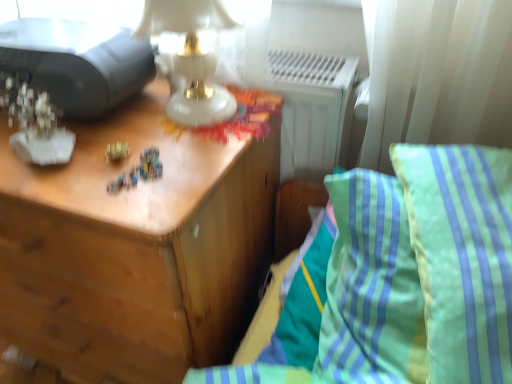
Question: From the image's perspective, would you say gold metallic toy at center is shown under matte black printer at upper left?

Choices:
 (A) no
 (B) yes

Answer: (B)

Question: Is gold metallic toy at center oriented away from matte black printer at upper left?

Choices:
 (A) no
 (B) yes

Answer: (B)

Question: Does gold metallic toy at center turn towards matte black printer at upper left?

Choices:
 (A) yes
 (B) no

Answer: (B)

Question: Does gold metallic toy at center appear on the left side of matte black printer at upper left?

Choices:
 (A) yes
 (B) no

Answer: (B)

Question: Considering the relative sizes of gold metallic toy at center and matte black printer at upper left in the image provided, is gold metallic toy at center bigger than matte black printer at upper left?

Choices:
 (A) yes
 (B) no

Answer: (B)

Question: Is gold metallic toy at center in contact with matte black printer at upper left?

Choices:
 (A) yes
 (B) no

Answer: (B)

Question: Is gold metallic toy at center to the right of wooden nightstand at left from the viewer's perspective?

Choices:
 (A) no
 (B) yes

Answer: (B)

Question: Is gold metallic toy at center facing towards wooden nightstand at left?

Choices:
 (A) no
 (B) yes

Answer: (A)

Question: Is gold metallic toy at center bigger than wooden nightstand at left?

Choices:
 (A) yes
 (B) no

Answer: (B)

Question: Considering the relative positions of gold metallic toy at center and wooden nightstand at left in the image provided, is gold metallic toy at center behind wooden nightstand at left?

Choices:
 (A) yes
 (B) no

Answer: (A)

Question: From the image's perspective, is gold metallic toy at center below wooden nightstand at left?

Choices:
 (A) no
 (B) yes

Answer: (A)

Question: Is gold metallic toy at center outside of wooden nightstand at left?

Choices:
 (A) yes
 (B) no

Answer: (A)

Question: Does green striped pillow at right have a larger size compared to green striped pillow at right?

Choices:
 (A) no
 (B) yes

Answer: (A)